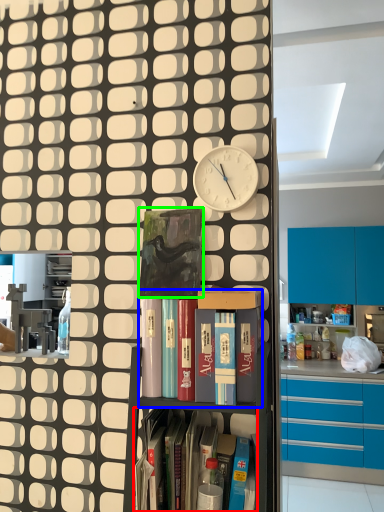
Question: Which object is the closest to the shelf (highlighted by a red box)? Choose among these: shelf (highlighted by a blue box) or paperback book (highlighted by a green box).

Choices:
 (A) shelf
 (B) paperback book

Answer: (A)